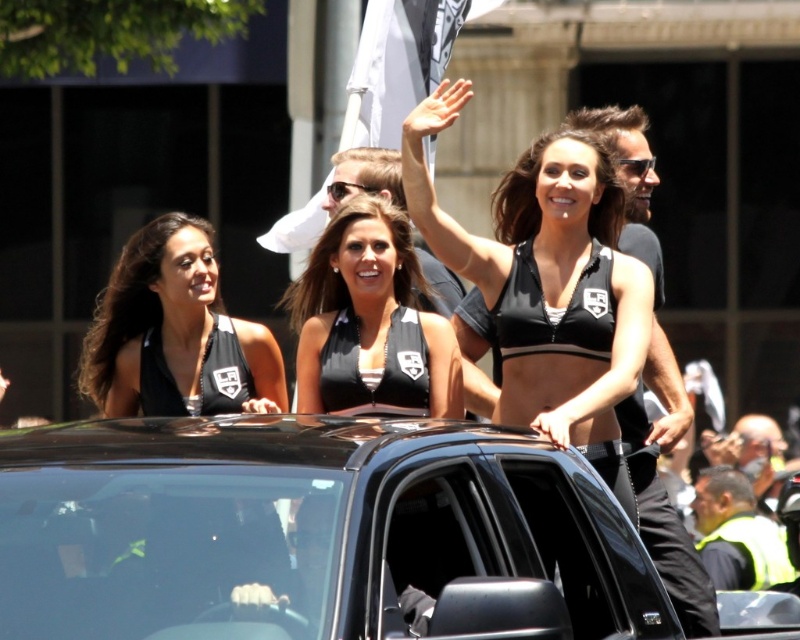
You are a photographer at the parade and need to capture both the black matte sports bra at upper center and the black matte bikini top at center in a single shot. Which one will appear taller in the photo?

The black matte sports bra at upper center will appear taller in the photo because it has a greater height compared to the black matte bikini top at center.

You are a photographer positioned at the back of the crowd, aiming to capture a clear shot of both the black matte sports bra at upper center and the black matte bikini top at center. Given the distance between them, will you need to adjust your camera lens to focus on both subjects simultaneously?

The distance between the black matte sports bra at upper center and the black matte bikini top at center is 17.20 feet. Since this distance is significant, you may need to adjust your camera lens to a wider angle to ensure both subjects are in frame and in focus.

You are a photographer trying to capture the black glossy suv at center and the black matte bikini top at center in a single shot. Which object should you position closer to the left side of your camera frame to ensure both are visible?

To ensure both the black glossy suv at center and the black matte bikini top at center are visible in your shot, position the black glossy suv at center closer to the left side of your camera frame since it is already to the right of the black matte bikini top at center.